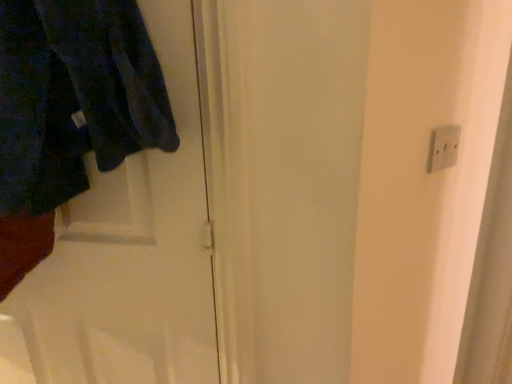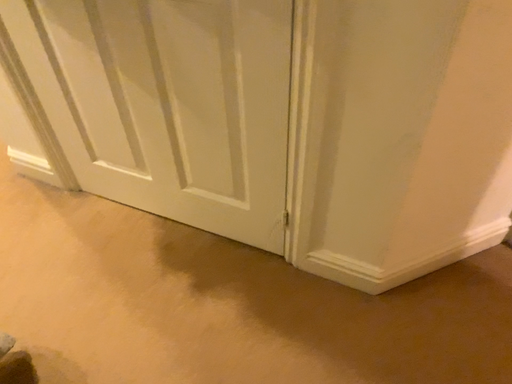
Question: Which way did the camera rotate in the video?

Choices:
 (A) rotated right
 (B) rotated left

Answer: (B)